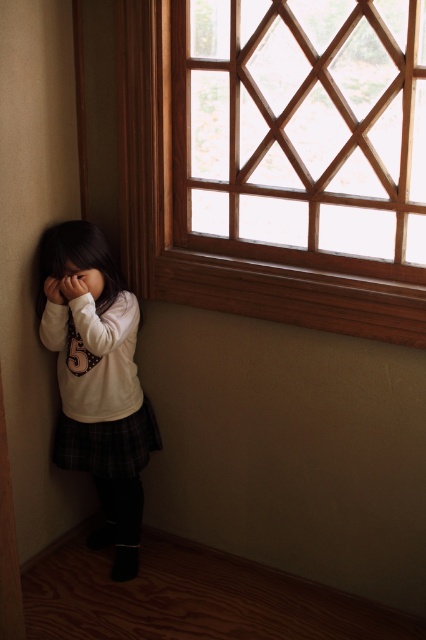
You are a parent trying to hang a picture frame that is 1 meter tall on the wall. You see the wooden lattice at upper right and the white matte shirt at lower left in the room. Which object can the frame fit under without overlapping?

The wooden lattice at upper right is much taller than the white matte shirt at lower left, so the frame can fit under the wooden lattice at upper right.

In the scene shown: You are a photographer trying to capture a closeup shot of the white matte shirt at lower left and the matte white face at lower left. Since both are white, you want to ensure you can distinguish them in the photo. Based on their positions, which object should appear lower in the frame?

The white matte shirt at lower left is located below the matte white face at lower left, so in the photo, the white matte shirt at lower left will appear lower in the frame than the matte white face at lower left.